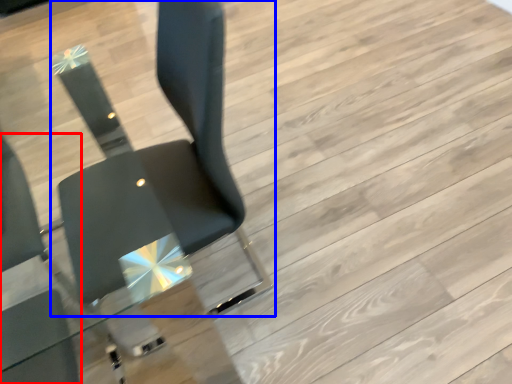
Question: Which object appears closest to the camera in this image, chair (highlighted by a red box) or chair (highlighted by a blue box)?

Choices:
 (A) chair
 (B) chair

Answer: (B)